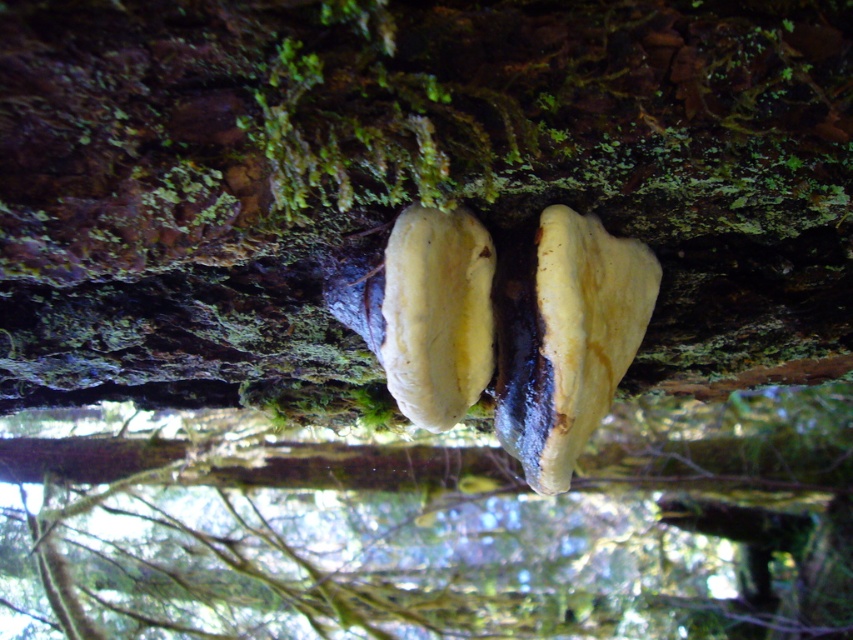
You are standing at the point marked as point (544, 476). You want to pick up a small rock that is exactly 30 inches away from you. Can you reach it without moving your feet?

The distance between you and the viewer is 27.55 inches, which is less than 30 inches. Therefore, you cannot reach the small rock without moving your feet.

You are a mycologist examining two yellowish matte fungi on a tree trunk. You notice both the yellowish matte fungus at center and the yellowish matte mushroom at center. Which one is closer to your eyes?

The yellowish matte fungus at center is closer to your eyes because it is positioned further to the viewer than the yellowish matte mushroom at center.

You are a mycologist examining two specimens on a tree trunk. You have a ruler and need to determine which one is wider. You see the yellowish matte fungus at center and the yellowish matte mushroom at center. Which one has a greater width?

The yellowish matte fungus at center has a greater width than the yellowish matte mushroom at center according to the description.